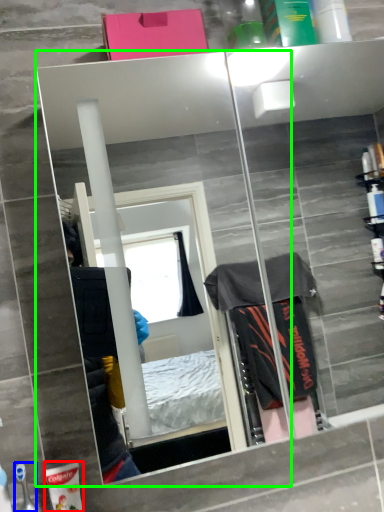
Question: Considering the real-world distances, which object is farthest from toiletry (highlighted by a red box)? toiletry (highlighted by a blue box) or mirror (highlighted by a green box)?

Choices:
 (A) toiletry
 (B) mirror

Answer: (B)